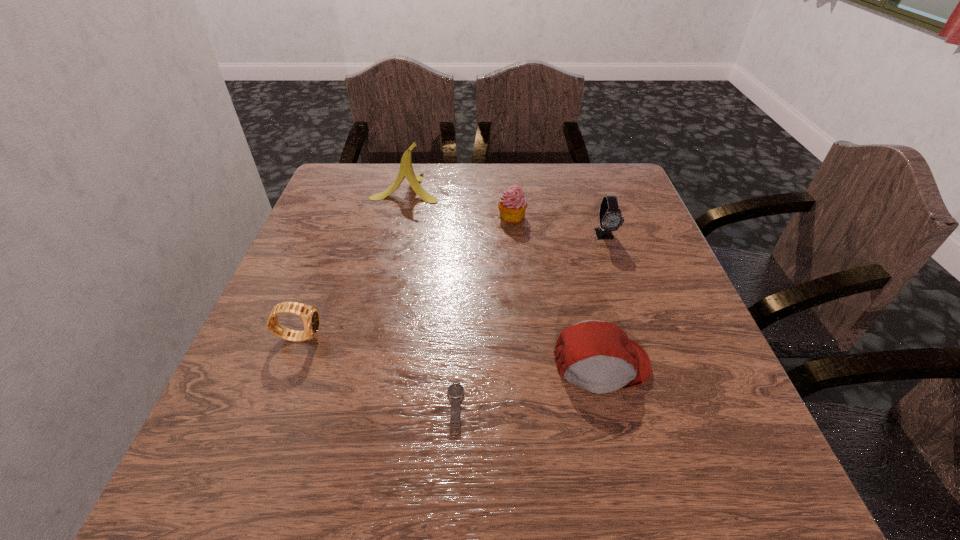
The image size is (960, 540). I want to click on watch that is at the right edge, so click(x=610, y=217).

This screenshot has height=540, width=960. Find the location of `cap present at the right edge`. cap present at the right edge is located at coordinates (598, 356).

Where is `object that is at the far left corner`? The image size is (960, 540). object that is at the far left corner is located at coordinates (406, 170).

Where is `free location at the far edge of the desktop`? This screenshot has width=960, height=540. free location at the far edge of the desktop is located at coordinates (526, 193).

Locate an element on the screen. Image resolution: width=960 pixels, height=540 pixels. vacant position at the left edge of the desktop is located at coordinates (323, 315).

Find the location of a particular element. The height and width of the screenshot is (540, 960). free space at the right edge is located at coordinates (724, 444).

This screenshot has width=960, height=540. In order to click on free point at the far left corner in this screenshot , I will do `click(366, 201)`.

Find the location of a particular element. free spot at the near left corner of the desktop is located at coordinates (289, 480).

Identify the location of vacant space at the far right corner of the desktop. The width and height of the screenshot is (960, 540). (592, 166).

Find the location of a particular element. Image resolution: width=960 pixels, height=540 pixels. empty space that is in between the tallest watch and the second tallest watch is located at coordinates (452, 285).